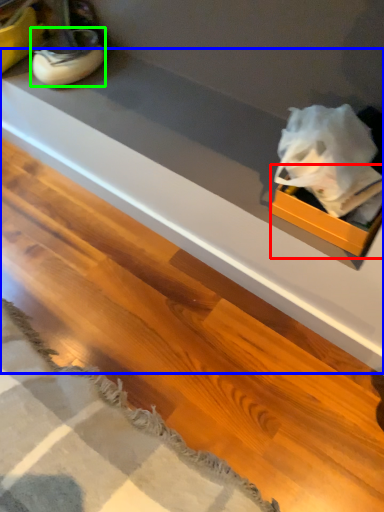
Question: Considering the real-world distances, which object is closest to box (highlighted by a red box)? counter top (highlighted by a blue box) or footwear (highlighted by a green box).

Choices:
 (A) counter top
 (B) footwear

Answer: (A)